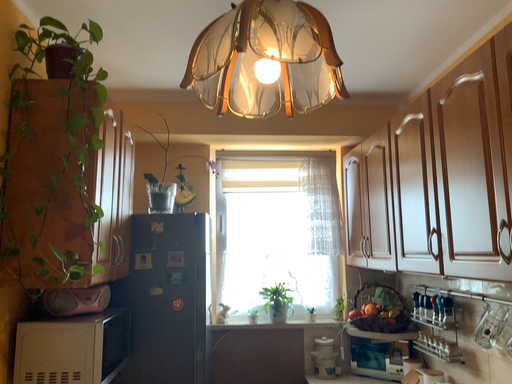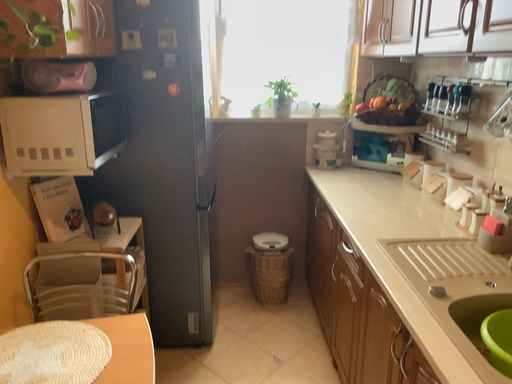
Question: Which way did the camera rotate in the video?

Choices:
 (A) rotated upward
 (B) rotated downward

Answer: (B)